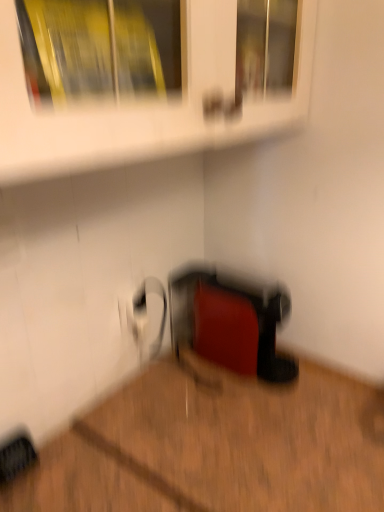
Question: Does rubberized red toaster at lower center have a smaller size compared to wooden floor at lower right?

Choices:
 (A) yes
 (B) no

Answer: (A)

Question: From the image's perspective, is rubberized red toaster at lower center located beneath wooden floor at lower right?

Choices:
 (A) no
 (B) yes

Answer: (A)

Question: Considering the relative positions of rubberized red toaster at lower center and wooden floor at lower right in the image provided, is rubberized red toaster at lower center in front of wooden floor at lower right?

Choices:
 (A) yes
 (B) no

Answer: (B)

Question: Would you say wooden floor at lower right is part of rubberized red toaster at lower center's contents?

Choices:
 (A) yes
 (B) no

Answer: (B)

Question: From the image's perspective, is rubberized red toaster at lower center located above wooden floor at lower right?

Choices:
 (A) no
 (B) yes

Answer: (B)

Question: Is rubberized red toaster at lower center bigger or smaller than white glossy shelf at upper center?

Choices:
 (A) small
 (B) big

Answer: (A)

Question: From a real-world perspective, relative to white glossy shelf at upper center, is rubberized red toaster at lower center vertically above or below?

Choices:
 (A) below
 (B) above

Answer: (A)

Question: Which is correct: rubberized red toaster at lower center is inside white glossy shelf at upper center, or outside of it?

Choices:
 (A) inside
 (B) outside

Answer: (B)

Question: Is rubberized red toaster at lower center wider or thinner than white glossy shelf at upper center?

Choices:
 (A) wide
 (B) thin

Answer: (B)

Question: Is rubberized red toaster at lower center bigger or smaller than wooden floor at lower right?

Choices:
 (A) big
 (B) small

Answer: (B)

Question: Considering the positions of point (193, 283) and point (160, 373), is point (193, 283) closer or farther from the camera than point (160, 373)?

Choices:
 (A) closer
 (B) farther

Answer: (B)

Question: Considering their positions, is rubberized red toaster at lower center located in front of or behind wooden floor at lower right?

Choices:
 (A) behind
 (B) front

Answer: (A)

Question: Considering the positions of rubberized red toaster at lower center and wooden floor at lower right in the image, is rubberized red toaster at lower center wider or thinner than wooden floor at lower right?

Choices:
 (A) thin
 (B) wide

Answer: (A)

Question: In terms of height, does wooden floor at lower right look taller or shorter compared to white glossy shelf at upper center?

Choices:
 (A) tall
 (B) short

Answer: (A)

Question: Considering the relative positions of wooden floor at lower right and white glossy shelf at upper center in the image provided, is wooden floor at lower right to the left or to the right of white glossy shelf at upper center?

Choices:
 (A) right
 (B) left

Answer: (A)